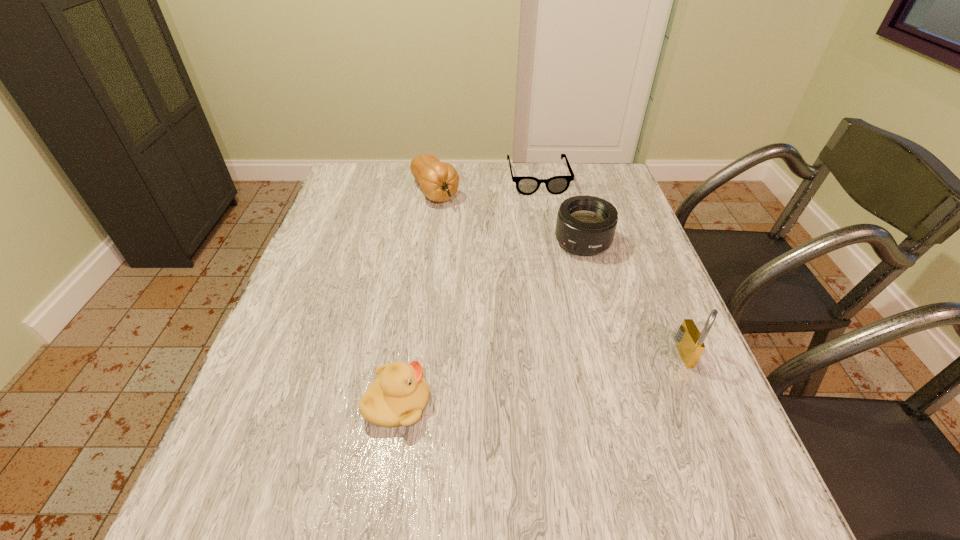
What are the coordinates of `vacant spot on the desktop that is between the nearest object and the rightmost object and is positioned on the stem side of the gourd` in the screenshot? It's located at (583, 372).

Where is `vacant space on the desktop that is between the duckling and the fourth farthest object and is positioned on the side of the third farthest object with brand markings and control switches`? The height and width of the screenshot is (540, 960). vacant space on the desktop that is between the duckling and the fourth farthest object and is positioned on the side of the third farthest object with brand markings and control switches is located at coordinates (512, 383).

Find the location of a particular element. free space on the desktop that is between the nearest object and the padlock and is positioned on the arms of the spectacles is located at coordinates (588, 370).